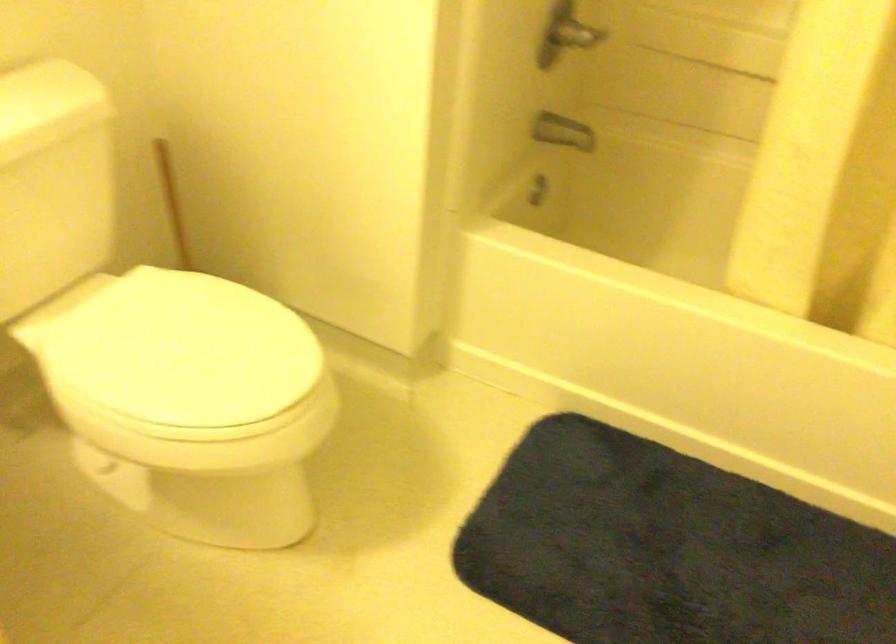
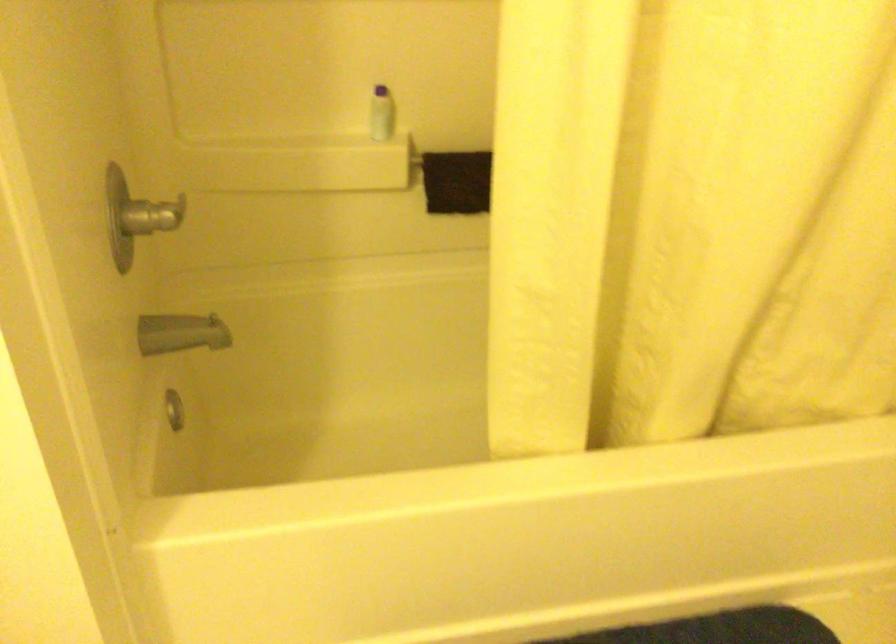
The point at (562, 128) is marked in the first image. Where is the corresponding point in the second image?

(181, 333)